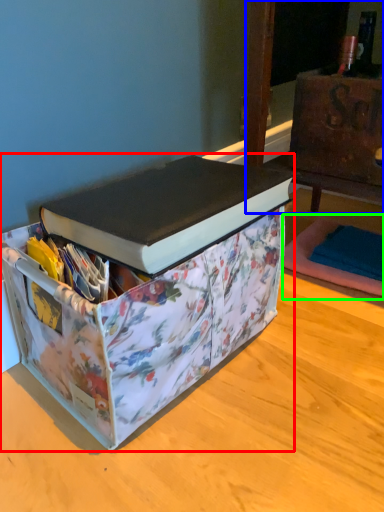
Question: Which is nearer to the box (highlighted by a red box)? furniture (highlighted by a blue box) or yoga mat (highlighted by a green box).

Choices:
 (A) furniture
 (B) yoga mat

Answer: (A)